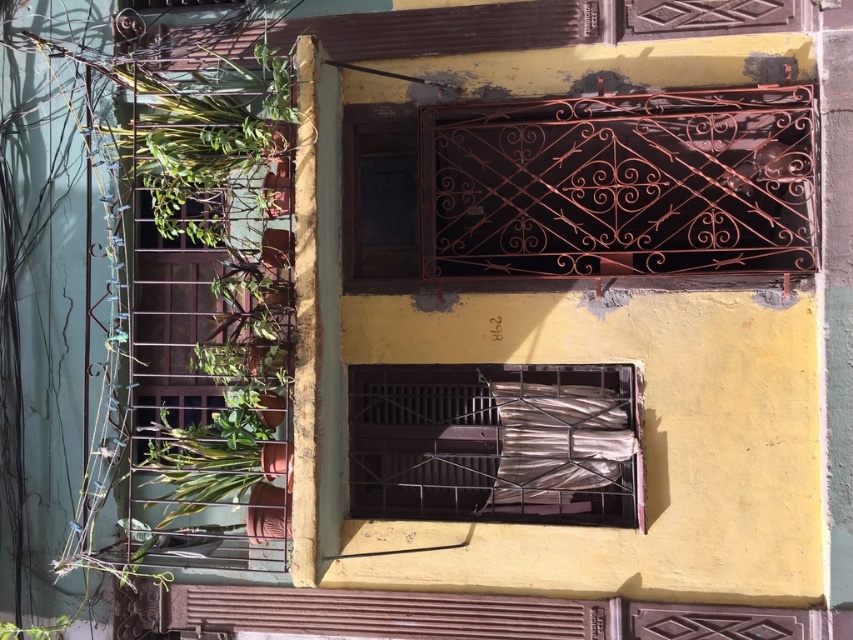
Is rusty metal gate at upper center behind brown matte window at center?

No, rusty metal gate at upper center is closer to the viewer.

Is rusty metal gate at upper center taller than brown matte window at center?

Yes, rusty metal gate at upper center is taller than brown matte window at center.

Does point (799, 122) lie behind point (560, 397)?

No, it is in front of (560, 397).

The width and height of the screenshot is (853, 640). I want to click on rusty metal gate at upper center, so click(x=619, y=184).

Is rusty metal gate at upper center taller than rusty metal shutter at lower center?

Correct, rusty metal gate at upper center is much taller as rusty metal shutter at lower center.

Can you confirm if rusty metal gate at upper center is smaller than rusty metal shutter at lower center?

No, rusty metal gate at upper center is not smaller than rusty metal shutter at lower center.

Image resolution: width=853 pixels, height=640 pixels. Describe the element at coordinates (619, 184) in the screenshot. I see `rusty metal gate at upper center` at that location.

Find the location of a particular element. The width and height of the screenshot is (853, 640). rusty metal gate at upper center is located at coordinates (619, 184).

Which of these two, brown matte window at center or rusty metal shutter at lower center, stands taller?

brown matte window at center

Consider the image. Does brown matte window at center have a smaller size compared to rusty metal shutter at lower center?

No.

Between point (619, 508) and point (233, 588), which one is positioned behind?

The point (233, 588) is more distant.

Locate an element on the screen. Image resolution: width=853 pixels, height=640 pixels. brown matte window at center is located at coordinates coord(494,442).